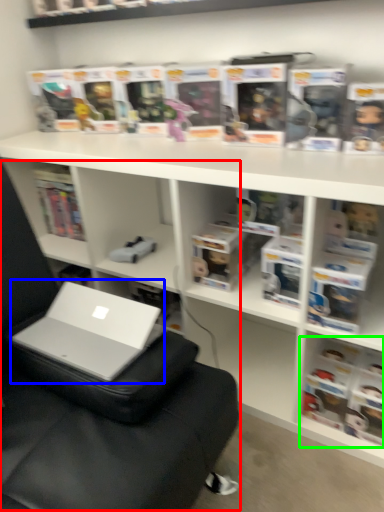
Question: Based on their relative distances, which object is nearer to bean bag chair (highlighted by a red box)? Choose from laptop (highlighted by a blue box) and book (highlighted by a green box).

Choices:
 (A) laptop
 (B) book

Answer: (A)